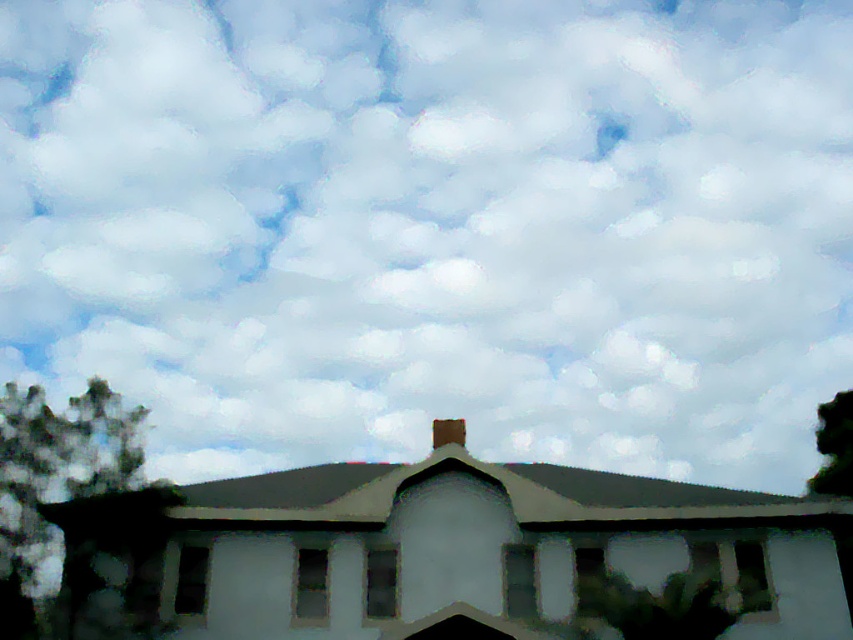
Question: Considering the real-world distances, which object is farthest from the green leafy tree at lower right?

Choices:
 (A) green matte tree at lower right
 (B) green leafy tree at lower left

Answer: (B)

Question: Is green leafy tree at lower left in front of green matte tree at lower right?

Choices:
 (A) no
 (B) yes

Answer: (A)

Question: From the image, what is the correct spatial relationship of green matte tree at lower right in relation to brown clay chimney at center?

Choices:
 (A) above
 (B) below

Answer: (B)

Question: Which of the following is the farthest from the observer?

Choices:
 (A) (445, 426)
 (B) (93, 472)
 (C) (820, 419)

Answer: (C)

Question: Does green leafy tree at lower left have a smaller size compared to green matte tree at lower right?

Choices:
 (A) yes
 (B) no

Answer: (B)

Question: Based on their relative distances, which object is nearer to the brown clay chimney at center?

Choices:
 (A) green matte tree at lower right
 (B) green leafy tree at lower right
 (C) green leafy tree at lower left

Answer: (A)